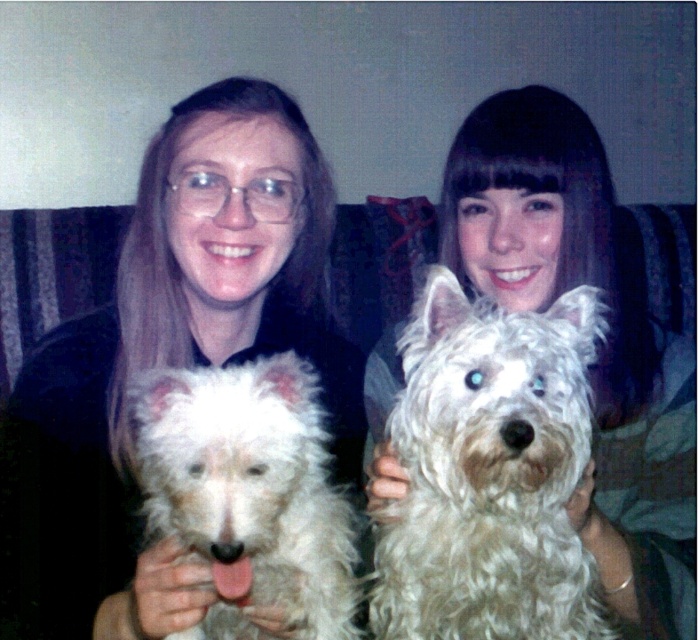
Question: Which object is closer to the camera taking this photo?

Choices:
 (A) white fluffy dog at center
 (B) fluffy white dog at center
 (C) matte black shirt at center

Answer: (A)

Question: Considering the relative positions of matte black shirt at center and fluffy white dog at center in the image provided, where is matte black shirt at center located with respect to fluffy white dog at center?

Choices:
 (A) left
 (B) right

Answer: (A)

Question: Which object is closer to the camera taking this photo?

Choices:
 (A) fluffy white dog at center
 (B) white fluffy dog at center
 (C) matte black shirt at center

Answer: (B)

Question: Is fluffy white dog at center bigger than white fluffy dog at center?

Choices:
 (A) yes
 (B) no

Answer: (B)

Question: Which object is closer to the camera taking this photo?

Choices:
 (A) white fluffy dog at center
 (B) fluffy white dog at center

Answer: (A)

Question: Does fluffy white dog at center appear on the left side of white fluffy dog at center?

Choices:
 (A) no
 (B) yes

Answer: (A)